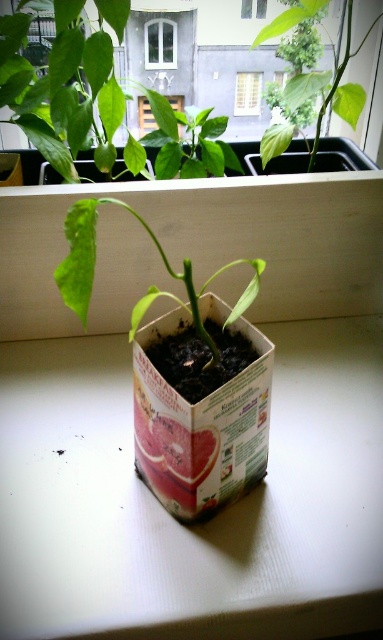
Does white plastic window at upper center appear on the left side of transparent glass window at upper center?

In fact, white plastic window at upper center is to the right of transparent glass window at upper center.

Is white plastic window at upper center smaller than transparent glass window at upper center?

Yes, white plastic window at upper center is smaller than transparent glass window at upper center.

Find the location of a particular element. This screenshot has height=640, width=383. white plastic window at upper center is located at coordinates (248, 93).

Is cardboard box at center positioned at the back of transparent glass window at upper center?

No.

Between cardboard box at center and transparent glass window at upper center, which one appears on the left side from the viewer's perspective?

Positioned to the left is transparent glass window at upper center.

What do you see at coordinates (199, 426) in the screenshot? I see `cardboard box at center` at bounding box center [199, 426].

You are a GUI agent. You are given a task and a screenshot of the screen. Output one action in this format:
    pyautogui.click(x=<x>, y=<y>)
    Task: Click on the cardboard box at center
    Image resolution: width=383 pixels, height=640 pixels.
    Given the screenshot: What is the action you would take?
    pyautogui.click(x=199, y=426)

Does cardboard box at center appear on the right side of green matte leafy plant at upper center?

In fact, cardboard box at center is to the left of green matte leafy plant at upper center.

This screenshot has height=640, width=383. Describe the element at coordinates (199, 426) in the screenshot. I see `cardboard box at center` at that location.

Where is `cardboard box at center`? cardboard box at center is located at coordinates (199, 426).